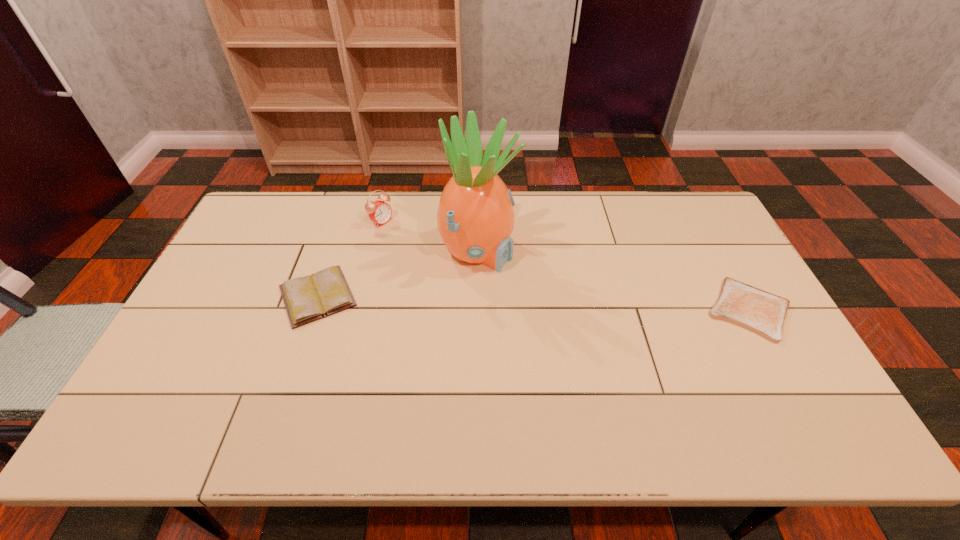
Image resolution: width=960 pixels, height=540 pixels. In order to click on diary in this screenshot , I will do `click(326, 292)`.

Image resolution: width=960 pixels, height=540 pixels. Find the location of `the shortest object`. the shortest object is located at coordinates (761, 312).

Identify the location of toast. (761, 312).

This screenshot has width=960, height=540. Identify the location of alarm clock. (380, 212).

The height and width of the screenshot is (540, 960). In order to click on the second object from right to left in this screenshot , I will do `click(475, 218)`.

I want to click on the tallest object, so click(x=475, y=218).

The height and width of the screenshot is (540, 960). I want to click on free space located on the right of the second shortest object, so click(494, 296).

The width and height of the screenshot is (960, 540). In order to click on free spot located on the left of the shortest object in this screenshot , I will do `click(596, 310)`.

Where is `vacant area situated on the clock face of the alarm clock`? vacant area situated on the clock face of the alarm clock is located at coordinates (426, 249).

Find the location of a particular element. This screenshot has width=960, height=540. free space located on the clock face of the alarm clock is located at coordinates (433, 254).